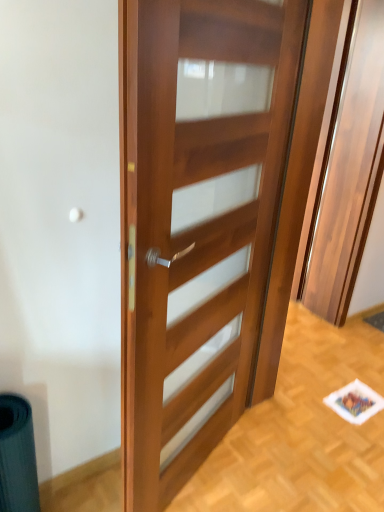
Question: Is wooden door at center taller or shorter than wooden door at center?

Choices:
 (A) tall
 (B) short

Answer: (A)

Question: Looking at their shapes, would you say wooden door at center is wider or thinner than wooden door at center?

Choices:
 (A) thin
 (B) wide

Answer: (B)

Question: Is point (352, 190) closer or farther from the camera than point (196, 30)?

Choices:
 (A) closer
 (B) farther

Answer: (B)

Question: Based on their positions, is wooden door at center located to the left or right of wooden door at center?

Choices:
 (A) right
 (B) left

Answer: (B)

Question: From a real-world perspective, is wooden door at center above or below wooden door at center?

Choices:
 (A) below
 (B) above

Answer: (A)

Question: Choose the correct answer: Is wooden door at center inside wooden door at center or outside it?

Choices:
 (A) outside
 (B) inside

Answer: (A)

Question: In terms of height, does wooden door at center look taller or shorter compared to wooden door at center?

Choices:
 (A) short
 (B) tall

Answer: (A)